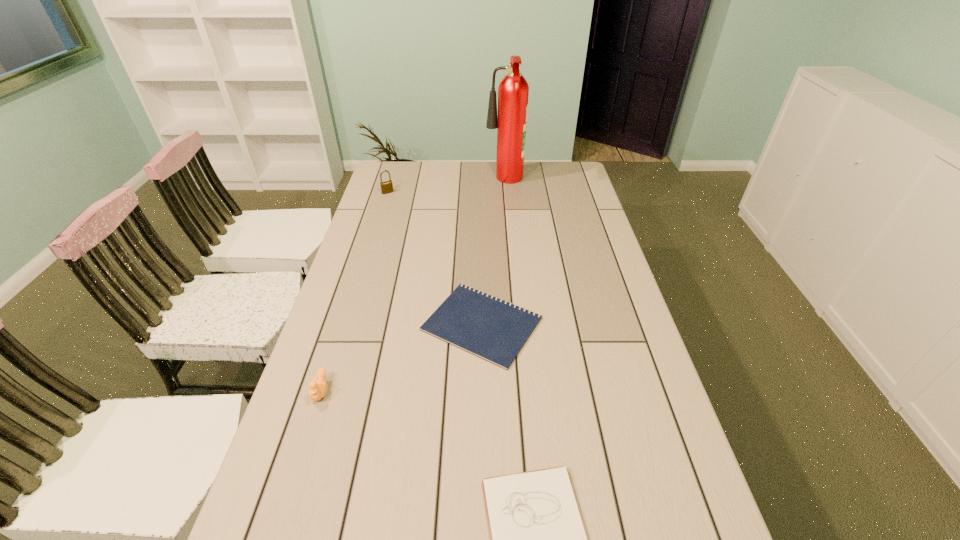
This screenshot has height=540, width=960. I want to click on unoccupied area between the farther notepad and the second nearest object, so click(x=401, y=357).

Image resolution: width=960 pixels, height=540 pixels. In order to click on vacant space in between the fourth farthest object and the padlock in this screenshot , I will do `click(354, 292)`.

The height and width of the screenshot is (540, 960). I want to click on vacant space that's between the fourth shortest object and the third tallest object, so click(354, 292).

Where is `vacant space that is in between the tallest object and the padlock`? This screenshot has height=540, width=960. vacant space that is in between the tallest object and the padlock is located at coordinates (446, 187).

What are the coordinates of `free point between the third tallest object and the second tallest object` in the screenshot? It's located at (354, 292).

Find the location of `vacant region between the third farthest object and the fourth farthest object`. vacant region between the third farthest object and the fourth farthest object is located at coordinates (401, 357).

Select which object appears as the fourth closest to the fourth shortest object. Please provide its 2D coordinates. Your answer should be formatted as a tuple, i.e. [(x, y)], where the tuple contains the x and y coordinates of a point satisfying the conditions above.

[(538, 539)]

Point out which object is positioned as the fourth nearest to the nearest object. Please provide its 2D coordinates. Your answer should be formatted as a tuple, i.e. [(x, y)], where the tuple contains the x and y coordinates of a point satisfying the conditions above.

[(386, 187)]

Locate an element on the screen. The width and height of the screenshot is (960, 540). vacant space that satisfies the following two spatial constraints: 1. at the nozzle of the fire extinguisher; 2. on the face of the duckling is located at coordinates (522, 391).

Find the location of a particular element. The width and height of the screenshot is (960, 540). free space that satisfies the following two spatial constraints: 1. at the nozzle of the fire extinguisher; 2. on the face of the fourth farthest object is located at coordinates (522, 391).